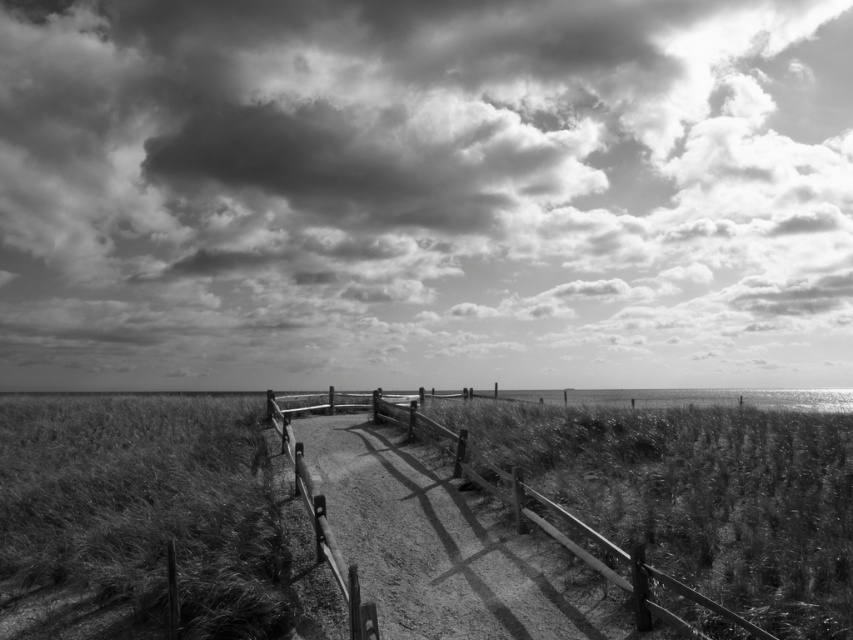
Who is more forward, (355, 371) or (165, 490)?

Point (165, 490)

Which is in front, point (239, 192) or point (86, 420)?

Positioned in front is point (86, 420).

In order to click on cloudy sky at upper center in this screenshot , I will do `click(424, 193)`.

How far apart are coarse textured grass at lower left and wooden fence at center?

coarse textured grass at lower left and wooden fence at center are 2.56 meters apart from each other.

Which is in front, point (120, 458) or point (305, 476)?

Positioned in front is point (305, 476).

Is point (73, 454) behind point (502, 488)?

Yes, it is.

Find the location of a particular element. coarse textured grass at lower left is located at coordinates (148, 506).

Which is behind, point (20, 304) or point (596, 541)?

Point (20, 304)

Does cloudy sky at upper center appear over wooden fence at center?

Yes, cloudy sky at upper center is above wooden fence at center.

At what (x,y) coordinates should I click in order to perform the action: click on cloudy sky at upper center. Please return your answer as a coordinate pair (x, y). This screenshot has width=853, height=640. Looking at the image, I should click on (424, 193).

Where is `cloudy sky at upper center`? The image size is (853, 640). cloudy sky at upper center is located at coordinates (424, 193).